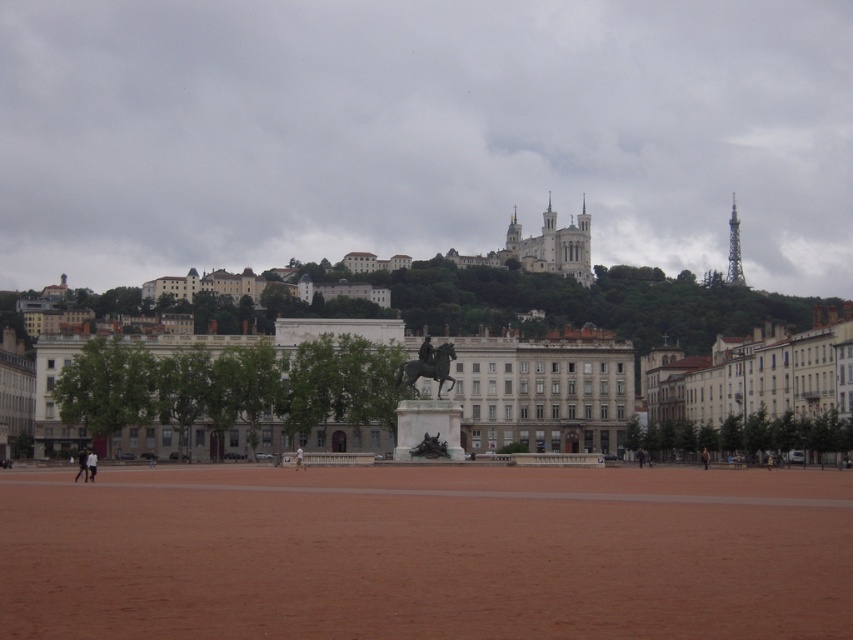
You are a landscape architect planning to install a new fountain in the square. The fountain requires a space that is wider than the white stone castle at upper center. Based on the scene, is the brown dirt field at center suitable for this purpose?

The brown dirt field at center might be wider than the white stone castle at upper center, so it could be suitable for installing the fountain if the width requirement is met.

You are a tourist standing at the edge of the square. You see the brown dirt field at center and the white stone castle at upper center. Which of these two landmarks is larger in size?

The white stone castle at upper center is larger than the brown dirt field at center.

You are standing at the edge of the square and want to locate the brown dirt field at center. According to the coordinates provided, in which direction should you look to find it?

The brown dirt field at center is located at coordinates point (427, 554), so you should look towards the center of the square to find it.